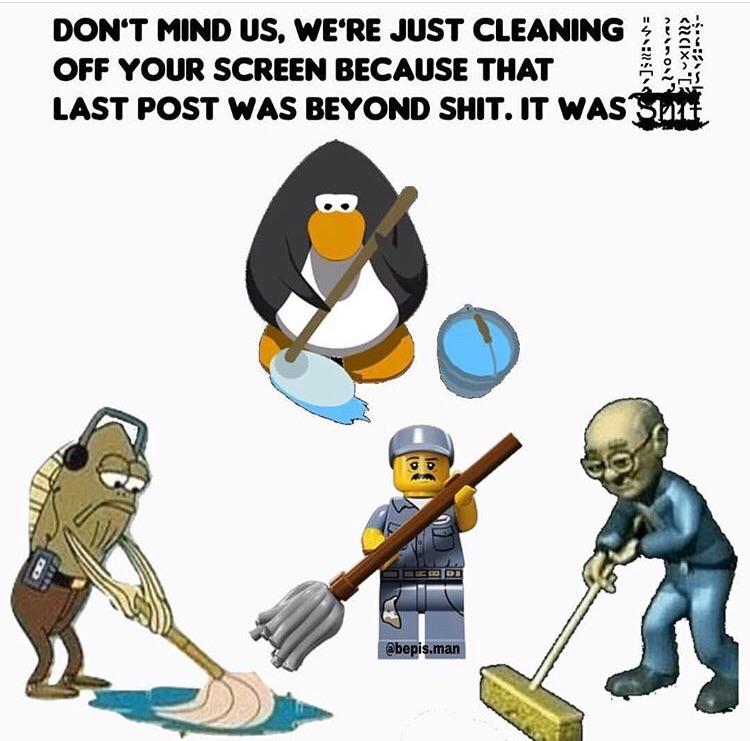
Where is `mops`? Image resolution: width=750 pixels, height=741 pixels. mops is located at coordinates (298, 385), (244, 697), (303, 627), (520, 694).